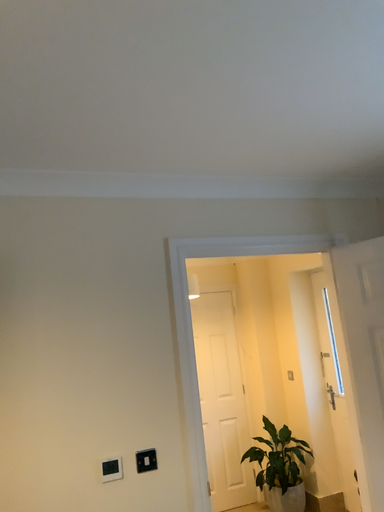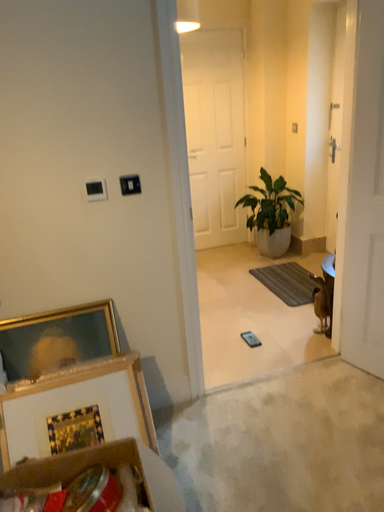
Question: Which way did the camera rotate in the video?

Choices:
 (A) rotated upward
 (B) rotated downward

Answer: (B)